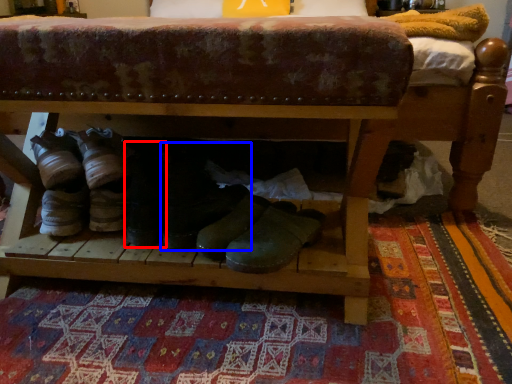
Question: Which object is closer to the camera taking this photo, footwear (highlighted by a red box) or footwear (highlighted by a blue box)?

Choices:
 (A) footwear
 (B) footwear

Answer: (B)